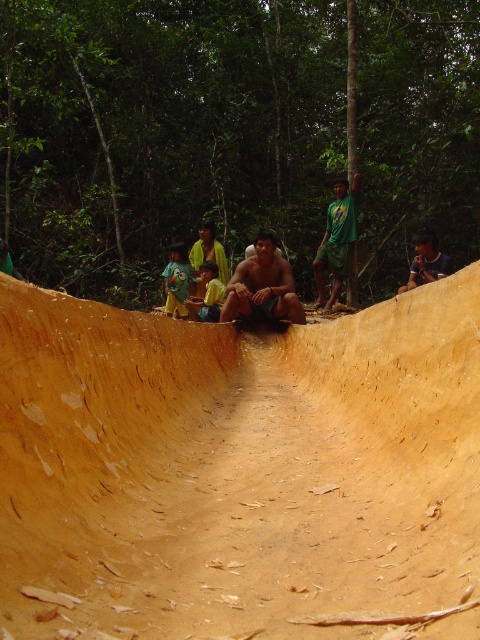
Question: Is brown rough wood at center to the right of green t-shirt at center from the viewer's perspective?

Choices:
 (A) yes
 (B) no

Answer: (A)

Question: Based on their relative distances, which object is nearer to the brown wood man at center?

Choices:
 (A) green t-shirt at center
 (B) green jersey at center
 (C) brown rough wood at center

Answer: (A)

Question: Does brown wood man at center have a lesser width compared to green t-shirt at center?

Choices:
 (A) no
 (B) yes

Answer: (A)

Question: Which object is the closest to the green t-shirt at center?

Choices:
 (A) brown wood man at center
 (B) brown rough wood at center
 (C) yellow shirt at center
 (D) green jersey at center

Answer: (C)

Question: Which object appears closest to the camera in this image?

Choices:
 (A) green t-shirt at center
 (B) brown wood man at center
 (C) green jersey at center
 (D) brown rough wood at center

Answer: (D)

Question: Can you confirm if brown wood man at center is positioned to the right of yellow shirt at center?

Choices:
 (A) no
 (B) yes

Answer: (B)